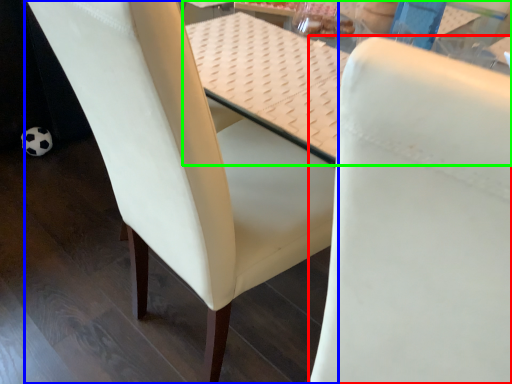
Question: Estimate the real-world distances between objects in this image. Which object is closer to chair (highlighted by a red box), chair (highlighted by a blue box) or table (highlighted by a green box)?

Choices:
 (A) chair
 (B) table

Answer: (A)